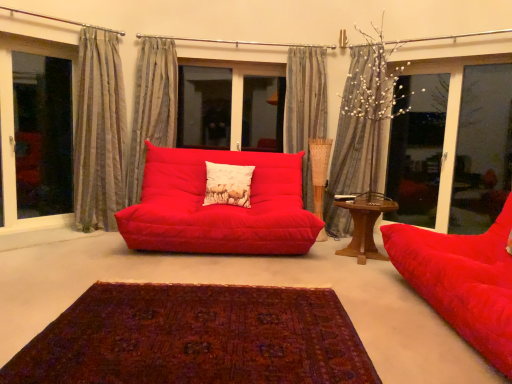
At what (x,y) coordinates should I click in order to perform the action: click on vacant space that's between matte red beanbag at right, acting as the first studio couch starting from the right, and deep burgundy woven rug at center. Please return your answer as a coordinate pair (x, y). Looking at the image, I should click on pyautogui.click(x=369, y=306).